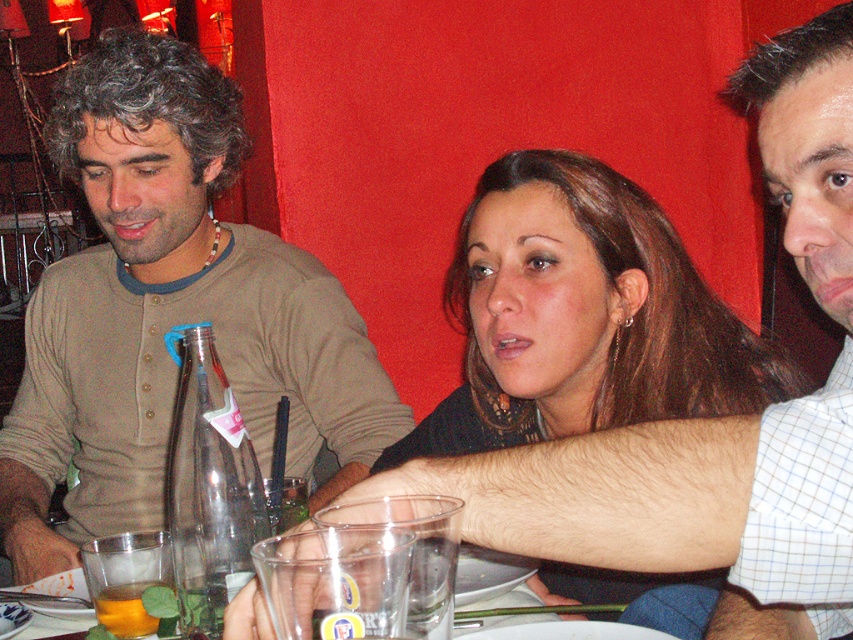
Does point (155, 56) come farther from viewer compared to point (230, 589)?

That is True.

Which is in front, point (231, 296) or point (206, 612)?

Positioned in front is point (206, 612).

Image resolution: width=853 pixels, height=640 pixels. Find the location of `matte brown shirt at left`. matte brown shirt at left is located at coordinates (169, 310).

Looking at this image, between smooth brown hair at center and translucent glass at lower left, which one has more height?

Standing taller between the two is smooth brown hair at center.

This screenshot has width=853, height=640. What do you see at coordinates (582, 316) in the screenshot?
I see `smooth brown hair at center` at bounding box center [582, 316].

Identify the location of smooth brown hair at center. Image resolution: width=853 pixels, height=640 pixels. (582, 316).

Can you confirm if translucent glass at lower left is positioned above translucent glass cup at lower left?

Indeed, translucent glass at lower left is positioned over translucent glass cup at lower left.

Is point (218, 614) positioned behind point (129, 609)?

No, (218, 614) is in front of (129, 609).

Image resolution: width=853 pixels, height=640 pixels. Find the location of `translucent glass at lower left`. translucent glass at lower left is located at coordinates (209, 602).